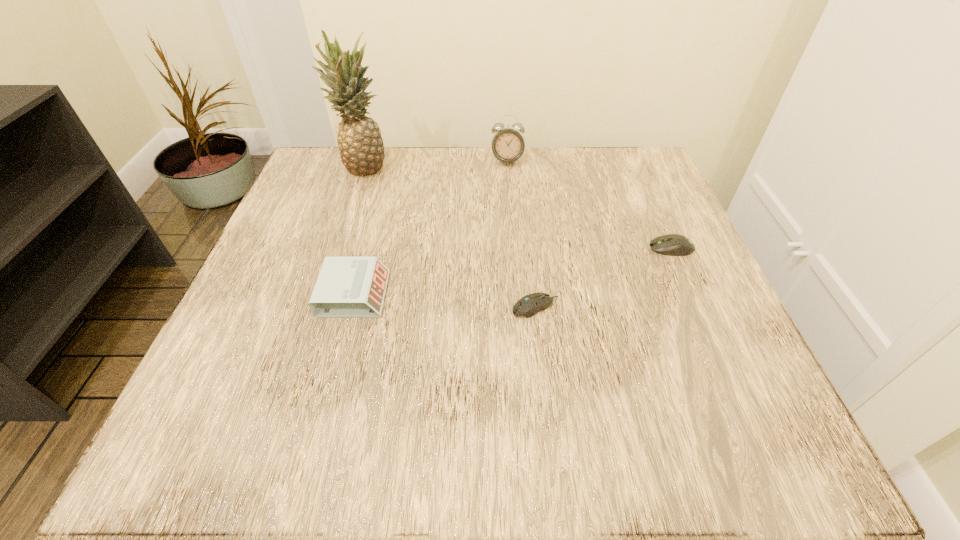
Where is `the third closest object relative to the left alarm clock`? Image resolution: width=960 pixels, height=540 pixels. the third closest object relative to the left alarm clock is located at coordinates (507, 144).

I want to click on vacant space that satisfies the following two spatial constraints: 1. on the wheel side of the rightmost object; 2. on the front side of the shortest object, so click(x=698, y=307).